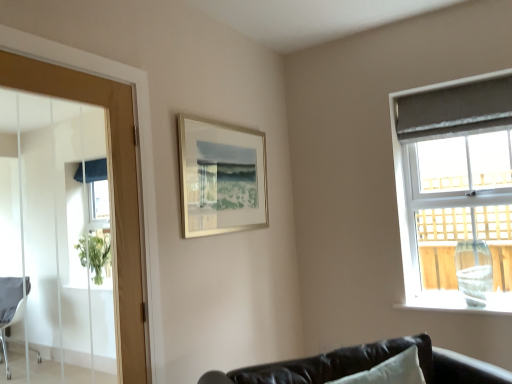
The image size is (512, 384). Identify the location of blank space situated above gray fabric curtain at upper right (from a real-world perspective). (444, 86).